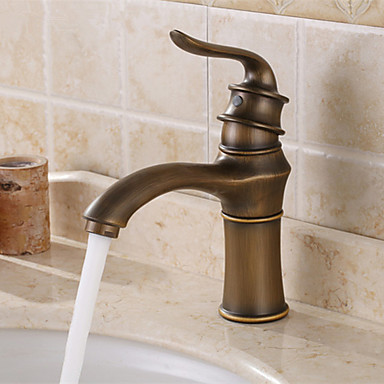
Image resolution: width=384 pixels, height=384 pixels. Find the location of `handle`. handle is located at coordinates (256, 65).